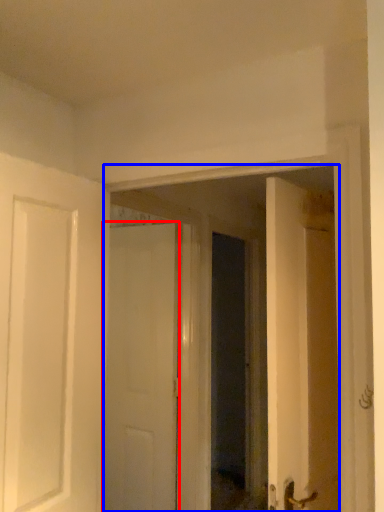
Question: Which of the following is the farthest to the observer, door (highlighted by a red box) or glass door (highlighted by a blue box)?

Choices:
 (A) door
 (B) glass door

Answer: (A)